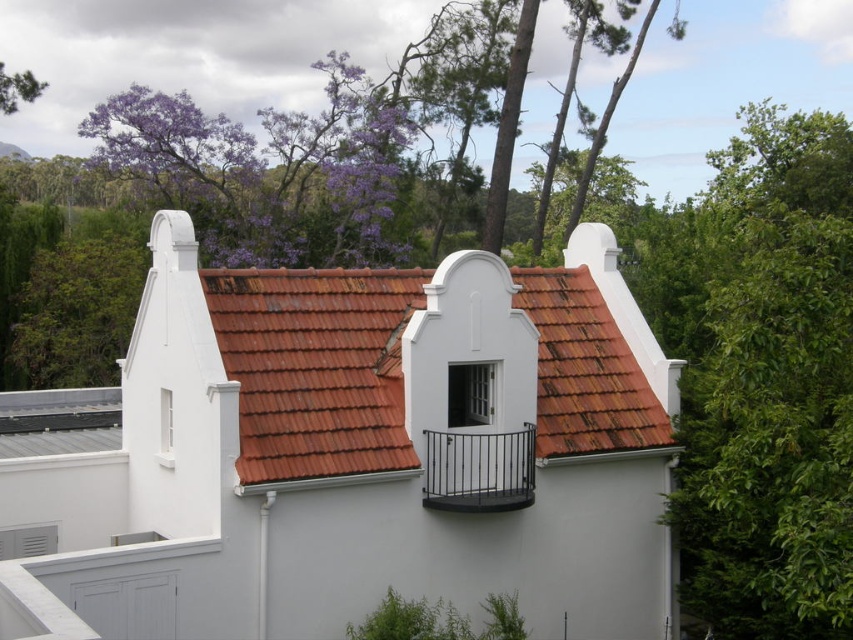
Question: Estimate the real-world distances between objects in this image. Which object is farther from the purple leafy tree at upper left?

Choices:
 (A) white matte balcony at upper center
 (B) green leafy tree at right

Answer: (A)

Question: Does white matte balcony at upper center have a larger size compared to black metal balcony at center?

Choices:
 (A) no
 (B) yes

Answer: (B)

Question: Which point is farther to the camera?

Choices:
 (A) purple leafy tree at upper left
 (B) green leafy tree at right

Answer: (A)

Question: Can you confirm if white matte balcony at upper center is positioned below green leafy tree at right?

Choices:
 (A) yes
 (B) no

Answer: (A)

Question: Among these points, which one is farthest from the camera?

Choices:
 (A) (318, 612)
 (B) (492, 445)

Answer: (B)

Question: Is white matte balcony at upper center behind purple leafy tree at upper left?

Choices:
 (A) yes
 (B) no

Answer: (B)